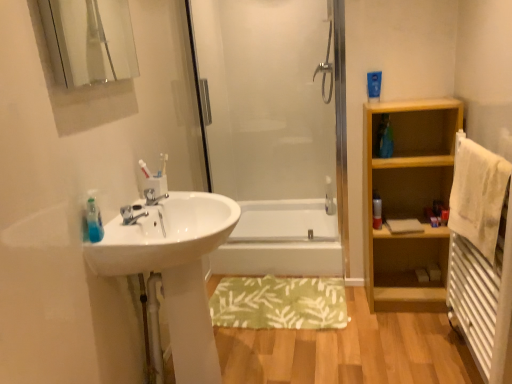
Question: Is green fabric bath mat at center taller than transparent glass shower door at center?

Choices:
 (A) no
 (B) yes

Answer: (A)

Question: From a real-world perspective, is green fabric bath mat at center on transparent glass shower door at center?

Choices:
 (A) yes
 (B) no

Answer: (B)

Question: Is green fabric bath mat at center bigger than transparent glass shower door at center?

Choices:
 (A) yes
 (B) no

Answer: (B)

Question: Is green fabric bath mat at center wider than transparent glass shower door at center?

Choices:
 (A) no
 (B) yes

Answer: (B)

Question: Is green fabric bath mat at center closer to camera compared to transparent glass shower door at center?

Choices:
 (A) yes
 (B) no

Answer: (A)

Question: Could you tell me if green fabric bath mat at center is turned towards transparent glass shower door at center?

Choices:
 (A) yes
 (B) no

Answer: (B)

Question: Can you confirm if transparent glass shower door at center is shorter than white soft towel at right?

Choices:
 (A) yes
 (B) no

Answer: (B)

Question: Considering the relative sizes of transparent glass shower door at center and white soft towel at right in the image provided, is transparent glass shower door at center thinner than white soft towel at right?

Choices:
 (A) yes
 (B) no

Answer: (B)

Question: Is transparent glass shower door at center located outside white soft towel at right?

Choices:
 (A) no
 (B) yes

Answer: (B)

Question: Can you confirm if transparent glass shower door at center is taller than white soft towel at right?

Choices:
 (A) yes
 (B) no

Answer: (A)

Question: From a real-world perspective, is transparent glass shower door at center located higher than white soft towel at right?

Choices:
 (A) yes
 (B) no

Answer: (A)

Question: Considering the relative positions of transparent glass shower door at center and white soft towel at right in the image provided, is transparent glass shower door at center behind white soft towel at right?

Choices:
 (A) yes
 (B) no

Answer: (A)

Question: Does clear glass mirror at upper left have a lesser height compared to white glossy bathtub at center?

Choices:
 (A) yes
 (B) no

Answer: (B)